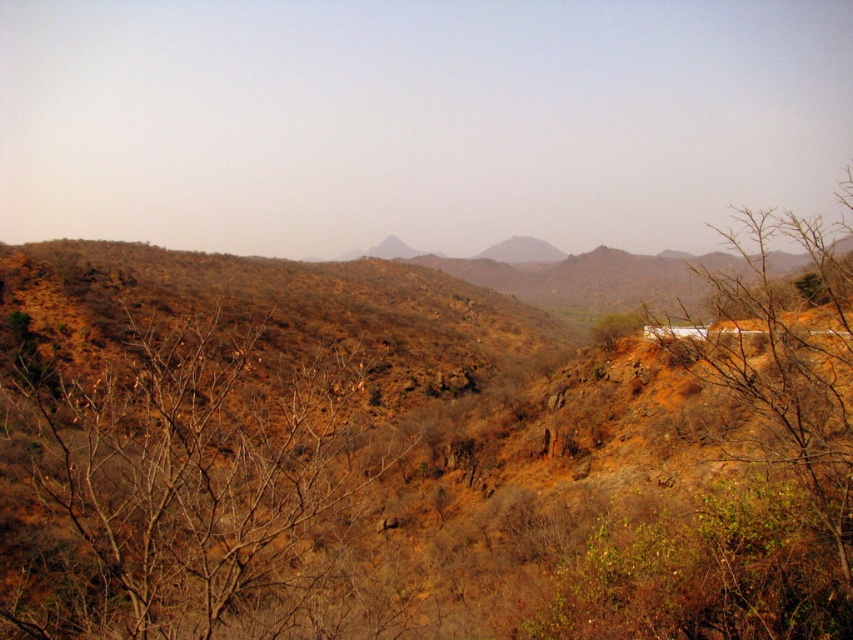
You are standing in the desert landscape described. There is a point marked at coordinates (170, 476). What object is located at this point?

The point at coordinates (170, 476) indicates brown leafless branches at left.

You are an explorer in the desert and see the brown leafless branches at left and the brown rocky mountain at center. Which object is positioned to the east if you are facing north?

The brown leafless branches at left are to the left of the brown rocky mountain at center. Since you are facing north, left would correspond to the west direction. Therefore, the brown leafless branches at left are positioned to the west of the mountain, meaning the mountain itself is to the east relative to the branches. However, since the question asks which object is to the east when facing north, the brown rocky mountain at center is east of the branches, so the answer is the brown rocky mountain at the

You are an explorer in this desert landscape. You see the brown leafless branches at left and the brown rocky mountain at center. Which object would appear closer to you based on their size?

The brown leafless branches at left appear closer because they are smaller in size compared to the brown rocky mountain at center, which is larger and farther away.